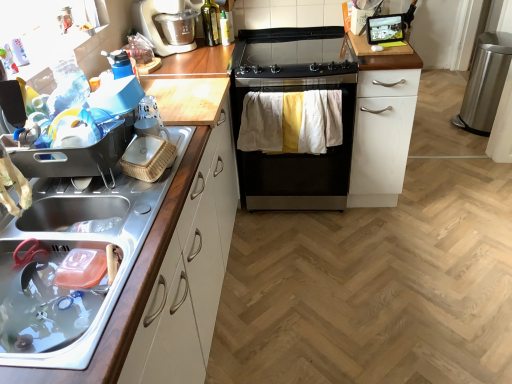
The image size is (512, 384). What are the coordinates of `free space in front of white matte cabinet at center-right, the 2th cabinetry in the front-to-back sequence` in the screenshot? It's located at (391, 230).